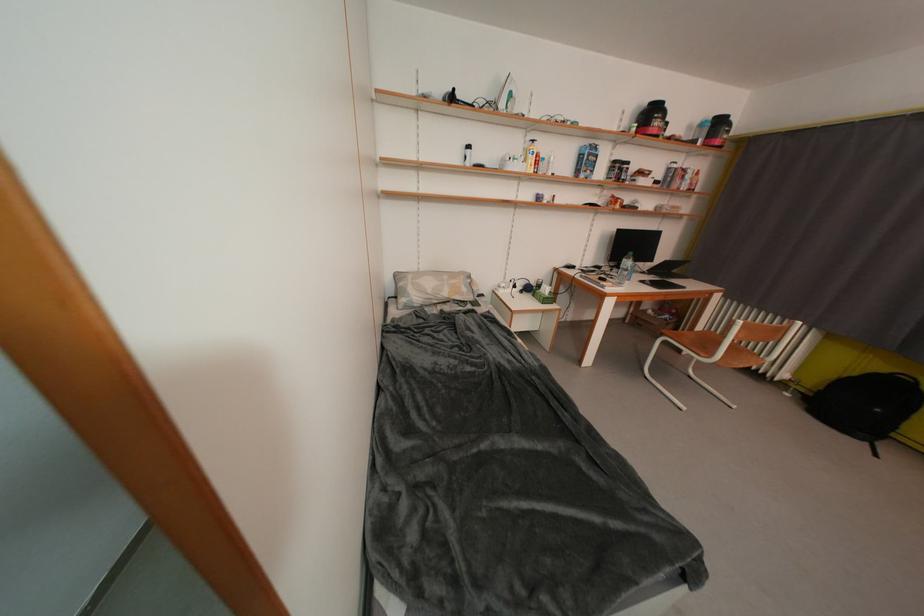
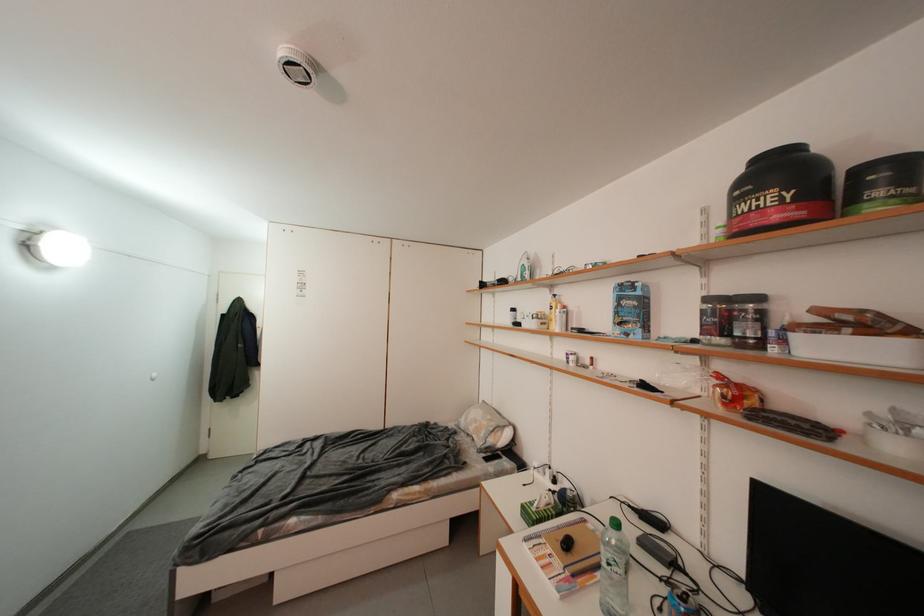
In the second image, find the point that corresponds to [597,158] in the first image.

(627, 302)